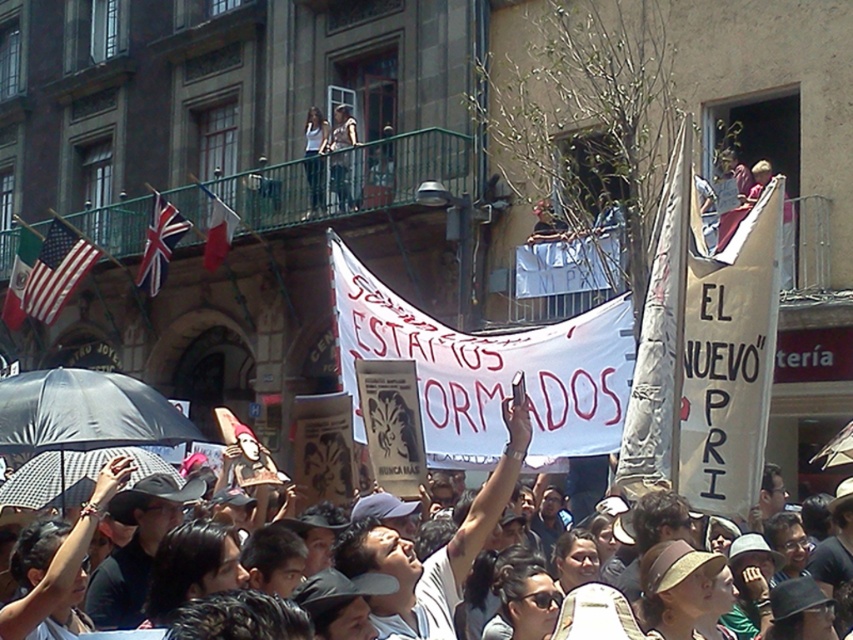
Question: Which point is farther to the camera?

Choices:
 (A) white shirt at upper center
 (B) light blue jeans at upper center
 (C) matte green flag at left

Answer: (C)

Question: Can you confirm if american flag at left is positioned to the left of white shirt at upper center?

Choices:
 (A) no
 (B) yes

Answer: (B)

Question: Can you confirm if american flag at left is smaller than light blue jeans at upper center?

Choices:
 (A) yes
 (B) no

Answer: (B)

Question: Can you confirm if american flag at left is positioned above red fabric flag at upper left?

Choices:
 (A) yes
 (B) no

Answer: (B)

Question: Which of the following is the closest to the observer?

Choices:
 (A) (91, 262)
 (B) (346, 138)
 (C) (144, 285)

Answer: (B)

Question: Which object is the farthest from the white paper banner at center?

Choices:
 (A) light blue jeans at upper center
 (B) american flag at left

Answer: (B)